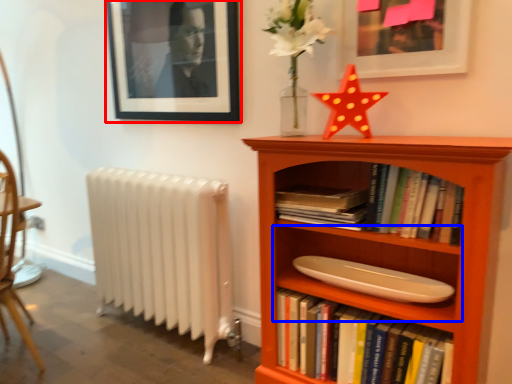
Question: Which object is closer to the camera taking this photo, picture frame (highlighted by a red box) or shelf (highlighted by a blue box)?

Choices:
 (A) picture frame
 (B) shelf

Answer: (B)